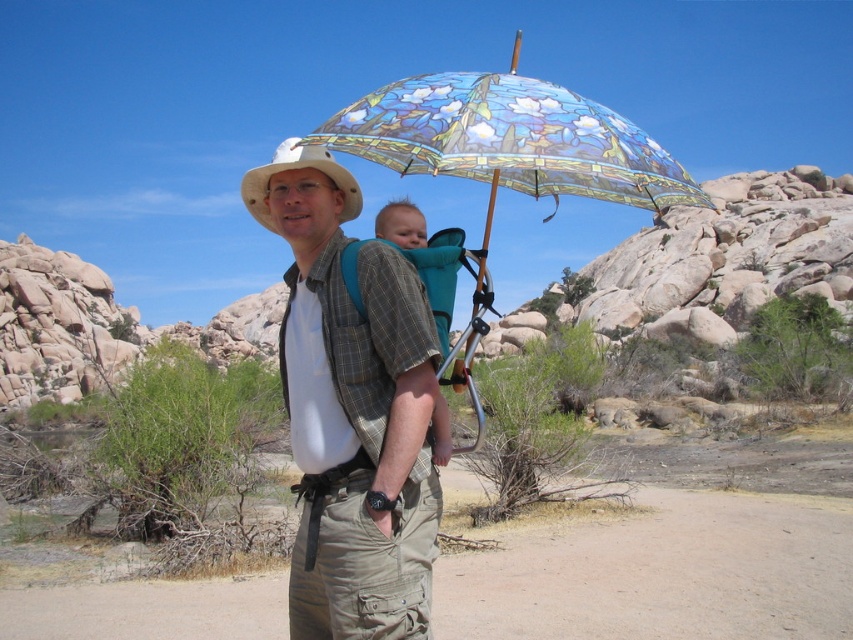
Is stained glass umbrella at upper center to the left of white matte cowboy hat at center from the viewer's perspective?

Incorrect, stained glass umbrella at upper center is not on the left side of white matte cowboy hat at center.

Is stained glass umbrella at upper center closer to camera compared to white matte cowboy hat at center?

That is True.

Who is more distant from viewer, (486, 161) or (289, 140)?

The point (289, 140) is behind.

Image resolution: width=853 pixels, height=640 pixels. Identify the location of stained glass umbrella at upper center. tap(509, 140).

Which of these two, plaid shirt at center or teal fabric carrier at center, stands taller?

plaid shirt at center is taller.

Does plaid shirt at center have a smaller size compared to teal fabric carrier at center?

Actually, plaid shirt at center might be larger than teal fabric carrier at center.

Locate an element on the screen. plaid shirt at center is located at coordinates (352, 410).

Is white matte cowboy hat at center further to camera compared to teal fabric carrier at center?

Yes, white matte cowboy hat at center is behind teal fabric carrier at center.

What do you see at coordinates (297, 168) in the screenshot? I see `white matte cowboy hat at center` at bounding box center [297, 168].

Locate an element on the screen. The image size is (853, 640). white matte cowboy hat at center is located at coordinates (297, 168).